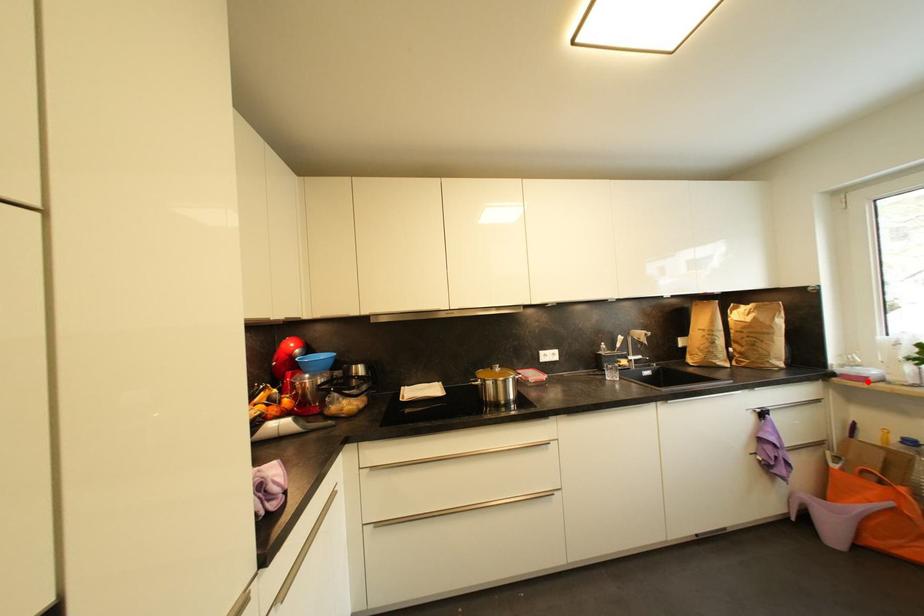
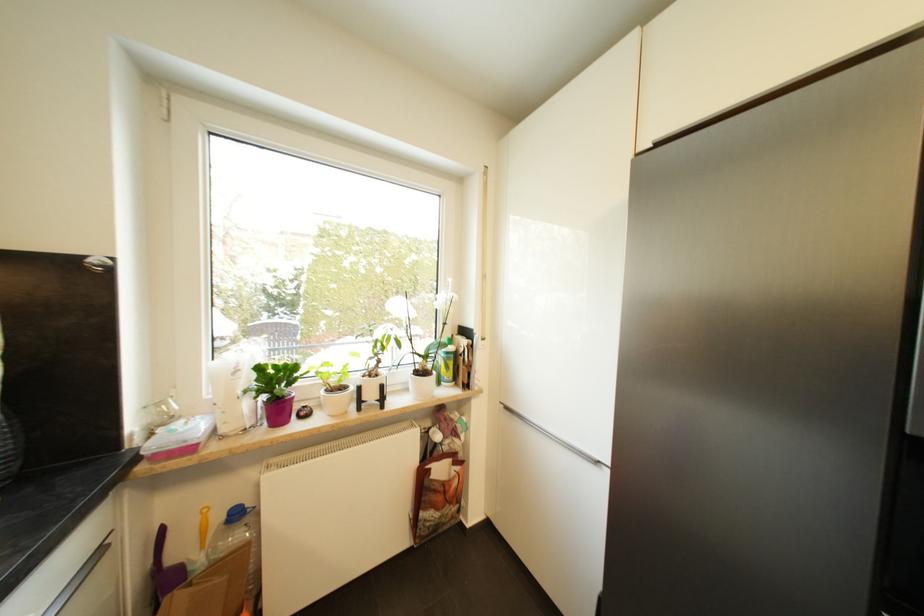
Find the pixel in the second image that matches the highlighted location in the first image.

(195, 451)